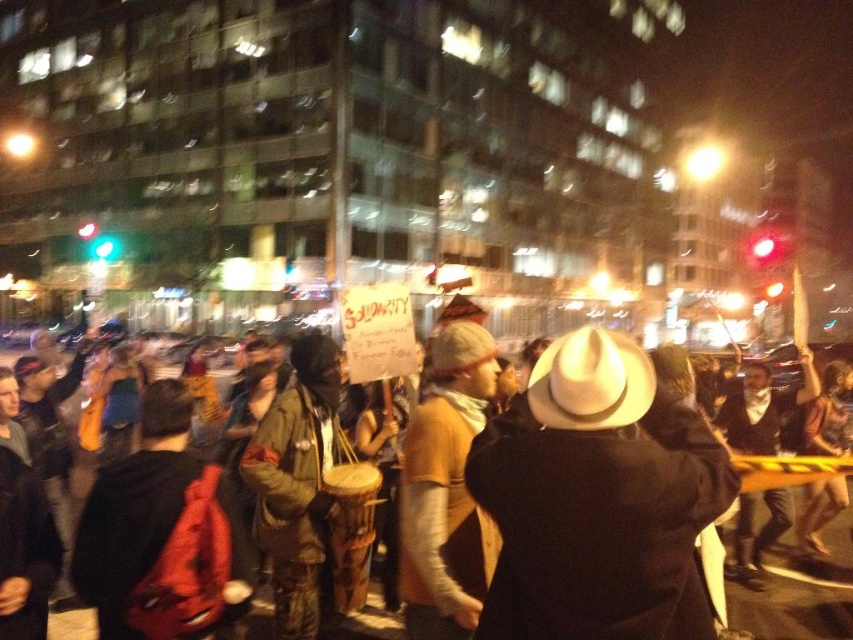
You are a photographer trying to capture the white matte hat at center in a nighttime urban protest scene. Based on its position, would it be visible in a photo taken from the front of the crowd?

The white matte hat at center is located at point (598,500), which is within the central area of the image, so it would be visible in a photo taken from the front of the crowd.

You are a photographer standing in the crowd at the protest. You want to take a photo of both the point at coordinates (614,356) and the point at coordinates (73,625). Given their positions, which point will appear larger in your photo?

Point (614,356) is closer to the camera than point (73,625), so it will appear larger in the photo.